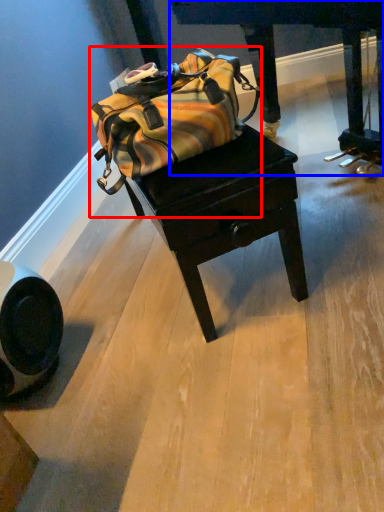
Question: Which object is further to the camera taking this photo, luggage and bags (highlighted by a red box) or furniture (highlighted by a blue box)?

Choices:
 (A) luggage and bags
 (B) furniture

Answer: (B)